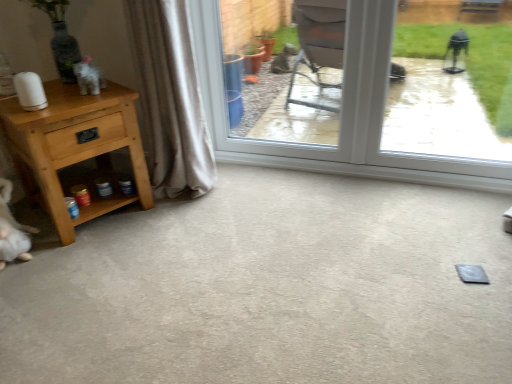
Where is `free space to the right of beige fabric curtain at left`? free space to the right of beige fabric curtain at left is located at coordinates (231, 190).